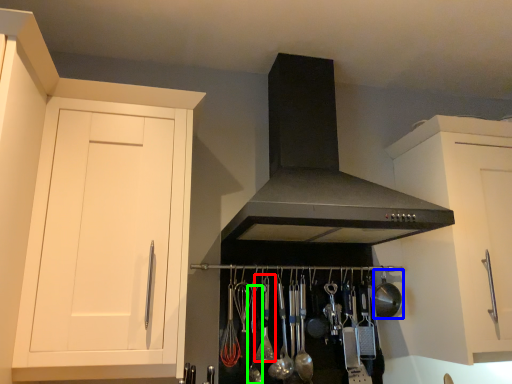
Question: Which is nearer to the utensil (highlighted by a red box)? appliance (highlighted by a blue box) or utensil (highlighted by a green box).

Choices:
 (A) appliance
 (B) utensil

Answer: (B)